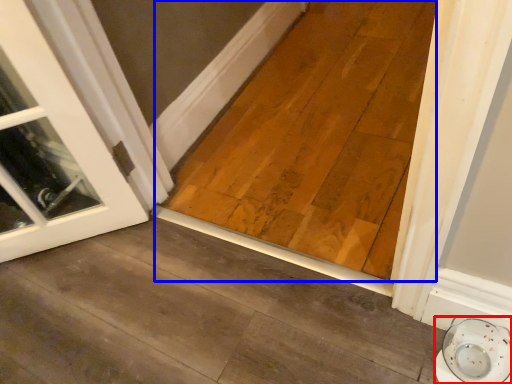
Question: Which object is further to the camera taking this photo, saucer (highlighted by a red box) or plank (highlighted by a blue box)?

Choices:
 (A) saucer
 (B) plank

Answer: (B)